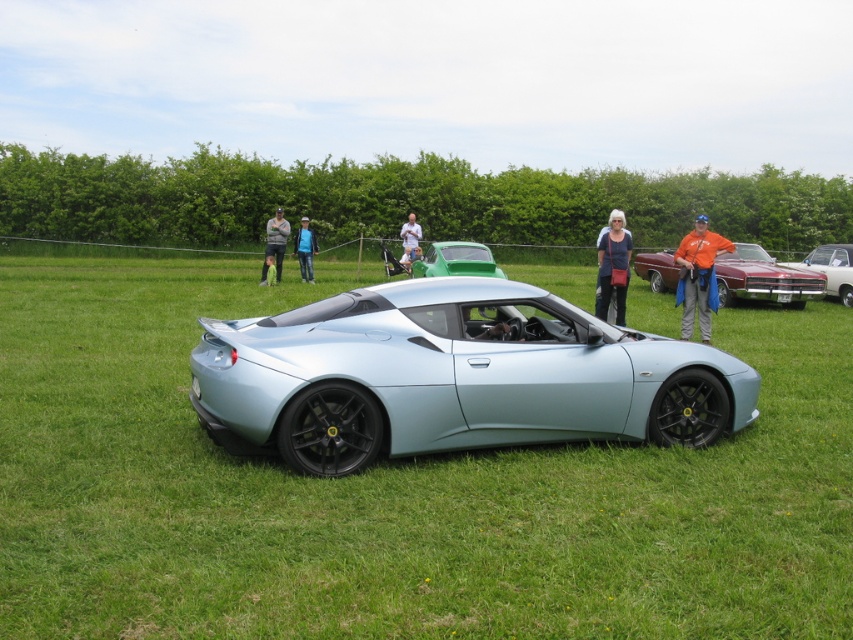
Does matte blue car at center have a greater width compared to denim jacket at center?

Yes.

Between point (807, 358) and point (265, 252), which one is positioned in front?

Point (807, 358) is in front.

This screenshot has height=640, width=853. What are the coordinates of `matte blue car at center` in the screenshot? It's located at (393, 492).

In the scene shown: Which is above, shiny red car at center or white fabric shirt at center?

white fabric shirt at center is higher up.

Who is more forward, (740, 292) or (416, 244)?

Point (740, 292)

In order to click on shiny red car at center in this screenshot , I will do `click(763, 278)`.

Is shiny red car at center above green matte car at center?

Yes, shiny red car at center is above green matte car at center.

Who is more distant from viewer, (672, 257) or (495, 264)?

The point (672, 257) is behind.

Is point (753, 264) more distant than point (419, 272)?

No, (753, 264) is closer to viewer.

Where is `shiny red car at center`? This screenshot has height=640, width=853. shiny red car at center is located at coordinates (763, 278).